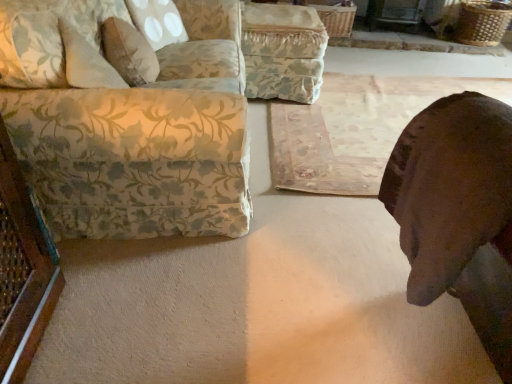
Question: Is rustic wooden mat at center outside floral fabric couch at left?

Choices:
 (A) no
 (B) yes

Answer: (B)

Question: Is rustic wooden mat at center looking in the opposite direction of floral fabric couch at left?

Choices:
 (A) no
 (B) yes

Answer: (A)

Question: From a real-world perspective, is rustic wooden mat at center physically below floral fabric couch at left?

Choices:
 (A) yes
 (B) no

Answer: (A)

Question: Would you say rustic wooden mat at center contains floral fabric couch at left?

Choices:
 (A) yes
 (B) no

Answer: (B)

Question: From a real-world perspective, is rustic wooden mat at center physically above floral fabric couch at left?

Choices:
 (A) no
 (B) yes

Answer: (A)

Question: Would you say brown leather dog at lower right is to the left or to the right of fluffy beige pillow at upper left in the picture?

Choices:
 (A) left
 (B) right

Answer: (B)

Question: In terms of size, does brown leather dog at lower right appear bigger or smaller than fluffy beige pillow at upper left?

Choices:
 (A) small
 (B) big

Answer: (B)

Question: Is brown leather dog at lower right inside the boundaries of fluffy beige pillow at upper left, or outside?

Choices:
 (A) outside
 (B) inside

Answer: (A)

Question: Is brown leather dog at lower right in front of or behind fluffy beige pillow at upper left in the image?

Choices:
 (A) front
 (B) behind

Answer: (A)

Question: Relative to fluffy beige pillow at upper left, is floral fabric couch at left in front or behind?

Choices:
 (A) front
 (B) behind

Answer: (A)

Question: Is floral fabric couch at left bigger or smaller than fluffy beige pillow at upper left?

Choices:
 (A) small
 (B) big

Answer: (B)

Question: From the image's perspective, relative to fluffy beige pillow at upper left, is floral fabric couch at left above or below?

Choices:
 (A) above
 (B) below

Answer: (B)

Question: Considering the positions of point (12, 64) and point (128, 61), is point (12, 64) closer or farther from the camera than point (128, 61)?

Choices:
 (A) closer
 (B) farther

Answer: (A)

Question: From their relative heights in the image, would you say floral fabric ottoman at center is taller or shorter than rustic wooden mat at center?

Choices:
 (A) tall
 (B) short

Answer: (A)

Question: Is floral fabric ottoman at center inside or outside of rustic wooden mat at center?

Choices:
 (A) outside
 (B) inside

Answer: (A)